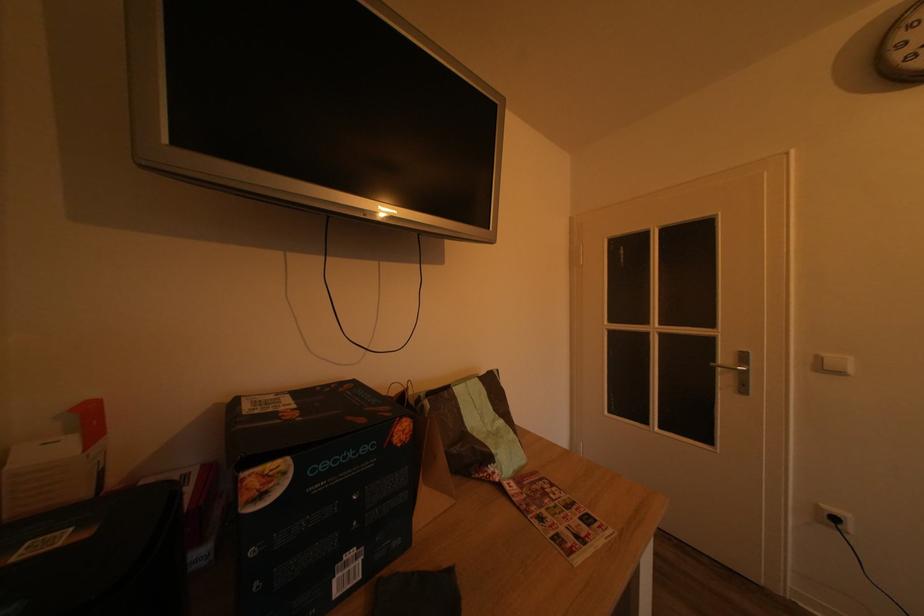
The image size is (924, 616). What do you see at coordinates (833, 363) in the screenshot?
I see `the white light switch` at bounding box center [833, 363].